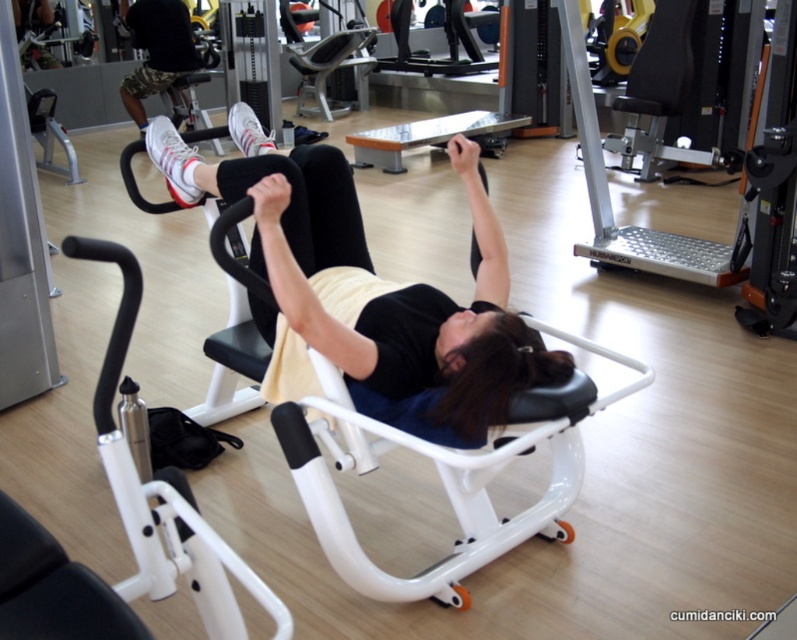
Question: Which point appears farthest from the camera in this image?

Choices:
 (A) (142, 1)
 (B) (452, 372)

Answer: (A)

Question: Is black matte exercise machine at center smaller than black camouflage shorts at upper left?

Choices:
 (A) yes
 (B) no

Answer: (B)

Question: Which point is closer to the camera?

Choices:
 (A) (124, 88)
 (B) (367, 376)

Answer: (B)

Question: Does black matte exercise machine at center appear under black camouflage shorts at upper left?

Choices:
 (A) yes
 (B) no

Answer: (A)

Question: Is the position of black matte exercise machine at center less distant than that of black camouflage shorts at upper left?

Choices:
 (A) no
 (B) yes

Answer: (B)